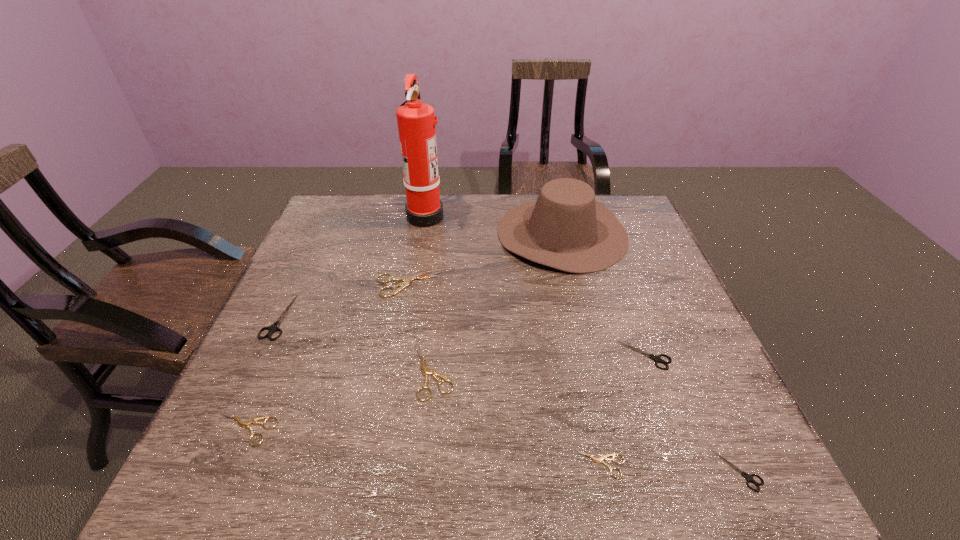
The width and height of the screenshot is (960, 540). I want to click on vacant area located on the back of the third nearest beige shears, so click(x=439, y=312).

This screenshot has width=960, height=540. What are the coordinates of `free region located 0.320m on the right of the third biggest beige shears` in the screenshot? It's located at pos(440,429).

Identify the location of free spot located on the back of the nearest black shears. (698, 379).

Identify the location of free spot located on the back of the shortest object. Image resolution: width=960 pixels, height=540 pixels. (566, 304).

Where is `fire extinguisher that is positioned at the far edge`? Image resolution: width=960 pixels, height=540 pixels. fire extinguisher that is positioned at the far edge is located at coordinates (416, 122).

Locate an element on the screen. This screenshot has width=960, height=540. cowboy hat that is positioned at the far edge is located at coordinates (565, 228).

Where is `cowboy hat that is positioned at the right edge`? The height and width of the screenshot is (540, 960). cowboy hat that is positioned at the right edge is located at coordinates (565, 228).

Locate an element on the screen. object present at the far right corner is located at coordinates (565, 228).

In order to click on object located at the near right corner in this screenshot , I will do `click(749, 477)`.

This screenshot has width=960, height=540. Find the location of `vacant space at the far edge of the desktop`. vacant space at the far edge of the desktop is located at coordinates (533, 195).